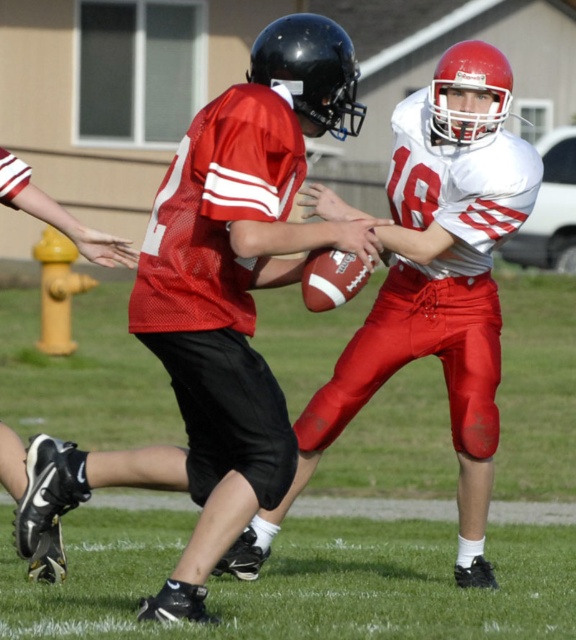
You are a referee observing the football game and need to determine if the matte red football at center is wider than the matte white jersey at center. Based on the description, can you confirm this?

The matte red football at center might be wider than matte white jersey at center, so based on the description, it is possible that the football is wider than the jersey.

You are a referee standing on the green grass football field at center. You need to retrieve the matte red football at center for a penalty kick. Can you walk directly to the ball without stepping off the field?

The matte red football at center is located on the green grass football field at center, so yes, you can walk directly to the ball without stepping off the field.